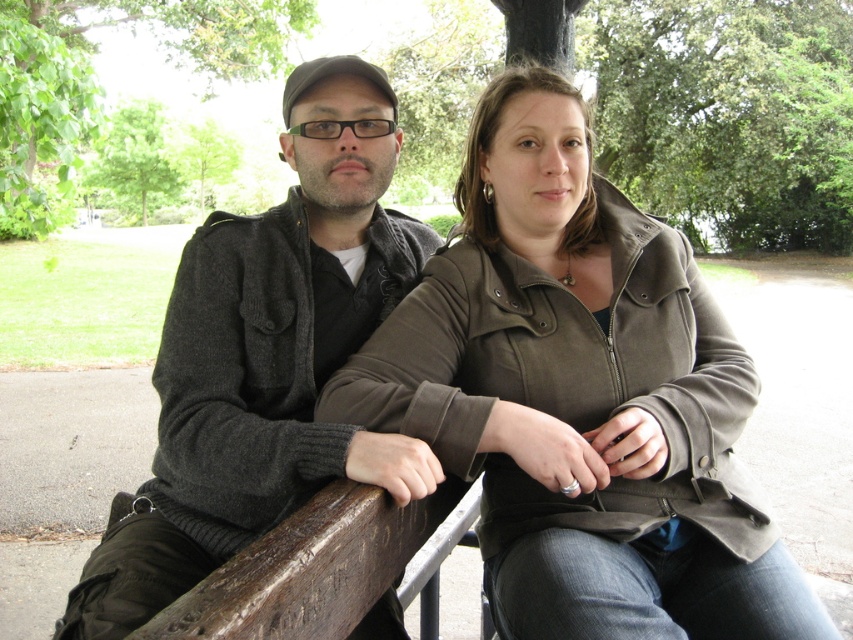
You are a photographer trying to capture both individuals in a single frame. Given that the matte olive green jacket at center and the dark gray sweater at center are both in focus, which one would appear larger in the photo?

The dark gray sweater at center would appear larger in the photo because it is larger than the matte olive green jacket at center.

You are a photographer trying to capture both individuals in a single frame. Given their positions and the height difference between the matte olive green jacket at center and the dark gray sweater at center, which person should you adjust to ensure both are fully visible in the photo?

The matte olive green jacket at center is shorter than the dark gray sweater at center. To ensure both are fully visible, you should lower the camera angle slightly so that the shorter individual wearing the matte olive green jacket at center is not blocked by the taller individual in the dark gray sweater at center.

You are a photographer standing in front of the two people on the bench. You want to take a photo where the matte olive green jacket at center is visible without being blocked by the dark gray sweater at center. Based on their positions, is this possible?

The matte olive green jacket at center is located above the dark gray sweater at center, so yes, the photographer can take a photo where the matte olive green jacket at center is visible without being blocked by the dark gray sweater at center because it is positioned higher up.